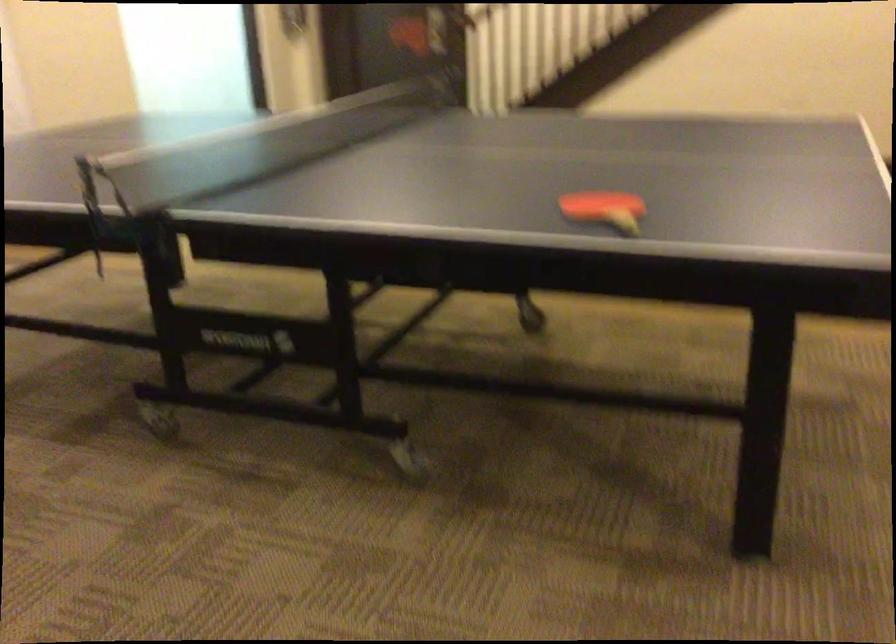
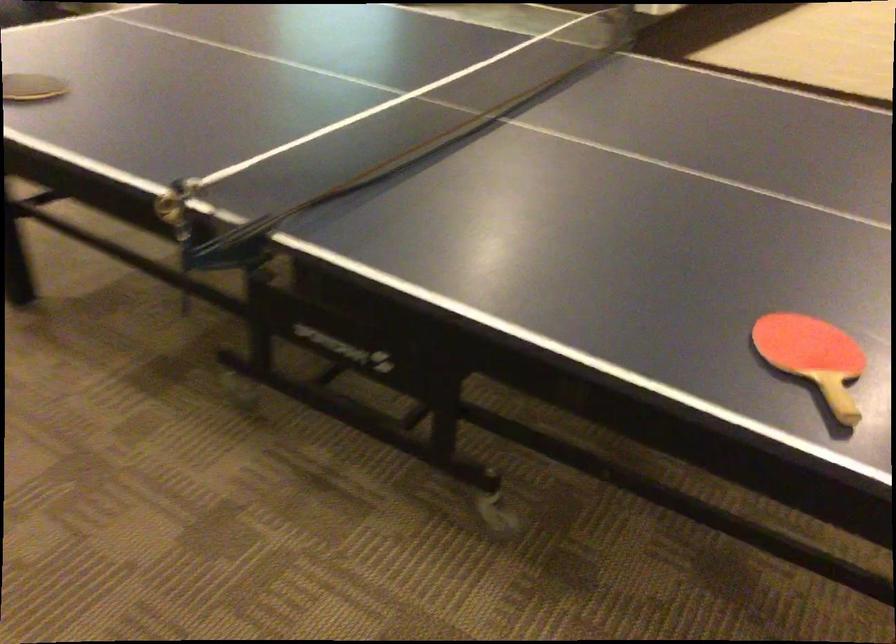
Find the pixel in the second image that matches pixel 400 438 in the first image.

(488, 494)